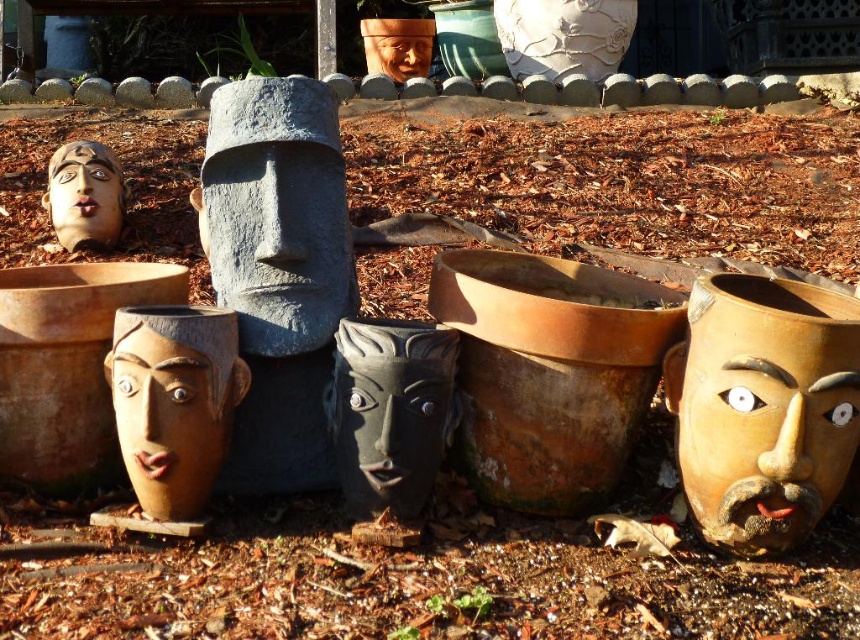
Does gray stone statue at center lie in front of matte clay mask at upper left?

Yes, gray stone statue at center is in front of matte clay mask at upper left.

Between point (243, 102) and point (78, 243), which one is positioned in front?

Point (243, 102)

Where is `gray stone statue at center`? This screenshot has width=860, height=640. gray stone statue at center is located at coordinates (277, 212).

Does brown matte mask at right have a greater height compared to matte clay mask at upper left?

Indeed, brown matte mask at right has a greater height compared to matte clay mask at upper left.

Between brown matte mask at right and matte clay mask at upper left, which one appears on the right side from the viewer's perspective?

brown matte mask at right

The width and height of the screenshot is (860, 640). In order to click on brown matte mask at right in this screenshot , I will do `click(763, 406)`.

This screenshot has width=860, height=640. I want to click on brown matte mask at right, so click(763, 406).

Based on the photo, does black matte mask at center come behind matte clay mask at upper left?

No, black matte mask at center is closer to the viewer.

Who is more forward, (370, 368) or (72, 216)?

Point (370, 368) is in front.

Identify the location of black matte mask at center. (389, 412).